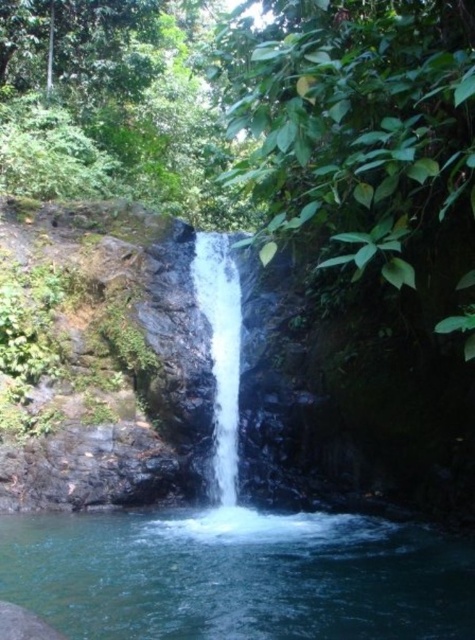
Which is behind, point (197, 540) or point (225, 355)?

Positioned behind is point (225, 355).

Image resolution: width=475 pixels, height=640 pixels. What do you see at coordinates (237, 576) in the screenshot?
I see `clear blue water at center` at bounding box center [237, 576].

Where is `clear blue water at center`? This screenshot has height=640, width=475. clear blue water at center is located at coordinates (237, 576).